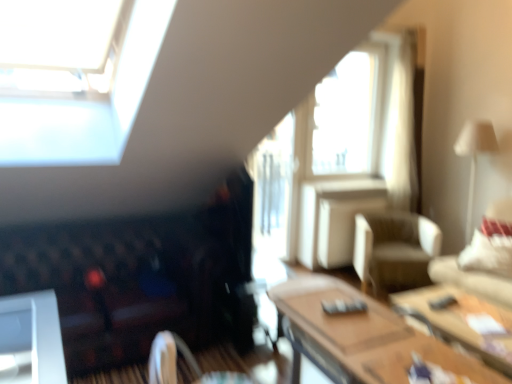
You are a GUI agent. You are given a task and a screenshot of the screen. Output one action in this format:
    pyautogui.click(x=<x>, y=<y>)
    Task: Click on the white fabric lampshade at upper right
    The image size is (512, 384).
    Given the screenshot: What is the action you would take?
    pyautogui.click(x=475, y=156)

You are a GUI agent. You are given a task and a screenshot of the screen. Output one action in this format:
    pyautogui.click(x=<x>, y=<y>)
    Task: Click on the velvet dark brown futon at lower left
    The height and width of the screenshot is (384, 512).
    Given the screenshot: What is the action you would take?
    pyautogui.click(x=124, y=281)

Measure the distance between point (x=129, y=277) and camera.

A distance of 2.94 meters exists between point (x=129, y=277) and camera.

In order to face wooden table at center, arranged as the second table when viewed from the right, should I rotate leftwards or rightwards?

A 12.171 degree turn to the right will do.

At what (x,y) coordinates should I click in order to perform the action: click on wooden table at center, the 2th table positioned from the back. Please return your answer as a coordinate pair (x, y). The width and height of the screenshot is (512, 384). Looking at the image, I should click on (360, 337).

This screenshot has height=384, width=512. In order to click on white fabric lampshade at upper right in this screenshot , I will do `click(475, 156)`.

From a real-world perspective, is wooden table at center, the 1th table from the left, positioned under beige fabric couch at right based on gravity?

Yes, from a real-world perspective, wooden table at center, the 1th table from the left, is below beige fabric couch at right.

Which is further, (330, 346) or (467, 283)?

The point (467, 283) is behind.

Considering the relative sizes of wooden table at center, the 2th table positioned from the back, and beige fabric couch at right in the image provided, is wooden table at center, the 2th table positioned from the back, smaller than beige fabric couch at right?

Yes.

Based on the photo, is wooden table at center, acting as the first table starting from the front, aimed at beige fabric couch at right?

Yes, wooden table at center, acting as the first table starting from the front, is aimed at beige fabric couch at right.

Looking at their sizes, would you say white fabric pillow at right is wider or thinner than wooden table at center, acting as the first table starting from the front?

In the image, white fabric pillow at right appears to be more narrow than wooden table at center, acting as the first table starting from the front.

Identify the location of pillow above the wooden table at center, the 2th table positioned from the back (from a real-world perspective). (488, 254).

From the image's perspective, is white fabric pillow at right on top of wooden table at center, acting as the first table starting from the front?

Yes, from the image's perspective, white fabric pillow at right is on top of wooden table at center, acting as the first table starting from the front.

Considering the positions of points (510, 268) and (375, 301), is point (510, 268) farther from camera compared to point (375, 301)?

Yes, it is behind point (375, 301).

Is white fabric pillow at right closer to camera compared to velvet dark brown swivel chair at lower center, placed as the first swivel chair when sorted from left to right?

No, it is not.

In the scene shown: From the image's perspective, between white fabric pillow at right and velvet dark brown swivel chair at lower center, which appears as the 2th swivel chair when viewed from the right, who is located below?

velvet dark brown swivel chair at lower center, which appears as the 2th swivel chair when viewed from the right, appears lower in the image.

Which is more to the left, white fabric pillow at right or velvet dark brown swivel chair at lower center, the 1th swivel chair viewed from the front?

Positioned to the left is velvet dark brown swivel chair at lower center, the 1th swivel chair viewed from the front.

Based on their sizes in the image, would you say white fabric pillow at right is bigger or smaller than velvet dark brown swivel chair at lower center, the 1th swivel chair viewed from the front?

In the image, white fabric pillow at right appears to be smaller than velvet dark brown swivel chair at lower center, the 1th swivel chair viewed from the front.

Can you confirm if velvet dark brown futon at lower left is positioned to the right of white fabric pillow at right?

No.

How many degrees apart are the facing directions of velvet dark brown futon at lower left and white fabric pillow at right?

There is a 89.5-degree angle between the facing directions of velvet dark brown futon at lower left and white fabric pillow at right.

Considering the relative sizes of velvet dark brown futon at lower left and white fabric pillow at right in the image provided, is velvet dark brown futon at lower left taller than white fabric pillow at right?

Yes, velvet dark brown futon at lower left is taller than white fabric pillow at right.

Is velvet dark brown futon at lower left far from white fabric pillow at right?

Yes, velvet dark brown futon at lower left and white fabric pillow at right are quite far apart.

In the image, is beige fabric couch at right positioned in front of or behind beige fabric swivel chair at center, the 2th swivel chair viewed from the left?

beige fabric couch at right is positioned closer to the viewer than beige fabric swivel chair at center, the 2th swivel chair viewed from the left.

Which object is thinner, beige fabric couch at right or beige fabric swivel chair at center, positioned as the second swivel chair in front-to-back order?

beige fabric swivel chair at center, positioned as the second swivel chair in front-to-back order, is thinner.

Does beige fabric couch at right have a larger size compared to beige fabric swivel chair at center, which is counted as the 1th swivel chair, starting from the back?

Yes.

Considering the relative sizes of wooden table at lower right, which is the first table from back to front, and beige fabric swivel chair at center, the 2th swivel chair viewed from the left, in the image provided, is wooden table at lower right, which is the first table from back to front, bigger than beige fabric swivel chair at center, the 2th swivel chair viewed from the left,?

Actually, wooden table at lower right, which is the first table from back to front, might be smaller than beige fabric swivel chair at center, the 2th swivel chair viewed from the left.

From a real-world perspective, does wooden table at lower right, positioned as the second table in left-to-right order, sit lower than beige fabric swivel chair at center, the 2th swivel chair viewed from the left?

Yes, from a real-world perspective, wooden table at lower right, positioned as the second table in left-to-right order, is beneath beige fabric swivel chair at center, the 2th swivel chair viewed from the left.

Is wooden table at lower right, positioned as the second table in left-to-right order, looking in the opposite direction of beige fabric swivel chair at center, the 2th swivel chair viewed from the left?

Yes, wooden table at lower right, positioned as the second table in left-to-right order, is facing away from beige fabric swivel chair at center, the 2th swivel chair viewed from the left.

Does wooden table at lower right, marked as the 2th table in a front-to-back arrangement, come in front of beige fabric swivel chair at center, positioned as the second swivel chair in front-to-back order?

That is True.

How different are the orientations of velvet dark brown futon at lower left and wooden table at lower right, which is the first table from back to front, in degrees?

There is a 0.679-degree angle between the facing directions of velvet dark brown futon at lower left and wooden table at lower right, which is the first table from back to front.

Measure the distance from velvet dark brown futon at lower left to wooden table at lower right, positioned as the second table in left-to-right order.

velvet dark brown futon at lower left is 5.51 feet away from wooden table at lower right, positioned as the second table in left-to-right order.

Does velvet dark brown futon at lower left appear on the right side of wooden table at lower right, which is the first table from back to front?

No.

From the picture: Would you say velvet dark brown futon at lower left is a long distance from wooden table at lower right, the first table viewed from the right?

Yes, velvet dark brown futon at lower left is far from wooden table at lower right, the first table viewed from the right.

Starting from the beige fabric couch at right, which table is the 2nd one to the left? Please provide its 2D coordinates.

[(360, 337)]

This screenshot has width=512, height=384. I want to click on pillow behind the wooden table at center, the 1th table from the left, so click(x=488, y=254).

Estimate the real-world distances between objects in this image. Which object is further from wooden table at center, the 2th table positioned from the back, beige fabric couch at right or velvet dark brown swivel chair at lower center, which is the second swivel chair from back to front?

beige fabric couch at right is positioned further to the anchor wooden table at center, the 2th table positioned from the back.

Considering their positions, is beige fabric swivel chair at center, the 1th swivel chair in the right-to-left sequence, positioned further to velvet dark brown futon at lower left than transparent glass window at upper center?

transparent glass window at upper center.

Looking at the image, which one is located further to transparent glass window at upper center, velvet dark brown swivel chair at lower center, the 1th swivel chair viewed from the front, or white fabric pillow at right?

The object further to transparent glass window at upper center is velvet dark brown swivel chair at lower center, the 1th swivel chair viewed from the front.

Looking at the image, which one is located closer to wooden table at center, the 1th table from the left, transparent glass window at upper center or velvet dark brown swivel chair at lower center, placed as the first swivel chair when sorted from left to right?

velvet dark brown swivel chair at lower center, placed as the first swivel chair when sorted from left to right, is positioned closer to the anchor wooden table at center, the 1th table from the left.

From the image, which object appears to be farther from transparent glass window at upper center, wooden table at lower right, positioned as the second table in left-to-right order, or beige fabric swivel chair at center, positioned as the second swivel chair in front-to-back order?

Among the two, wooden table at lower right, positioned as the second table in left-to-right order, is located further to transparent glass window at upper center.

Considering their positions, is white fabric lampshade at upper right positioned closer to beige fabric couch at right than transparent glass window at upper center?

white fabric lampshade at upper right is positioned closer to the anchor beige fabric couch at right.

Looking at the image, which one is located further to wooden table at lower right, marked as the 2th table in a front-to-back arrangement, wooden table at center, arranged as the second table when viewed from the right, or transparent glass window at upper center?

transparent glass window at upper center is positioned further to the anchor wooden table at lower right, marked as the 2th table in a front-to-back arrangement.

Which object lies nearer to the anchor point velvet dark brown futon at lower left, beige fabric swivel chair at center, which is counted as the 1th swivel chair, starting from the back, or white fabric pillow at right?

beige fabric swivel chair at center, which is counted as the 1th swivel chair, starting from the back, lies closer to velvet dark brown futon at lower left than the other object.

Where is `table between wooden table at center, arranged as the second table when viewed from the right, and white fabric lampshade at upper right in the front-back direction`? table between wooden table at center, arranged as the second table when viewed from the right, and white fabric lampshade at upper right in the front-back direction is located at coordinates (462, 323).

The width and height of the screenshot is (512, 384). What are the coordinates of `lamp between transparent glass window at upper center and beige fabric swivel chair at center, the 1th swivel chair in the right-to-left sequence, from top to bottom` in the screenshot? It's located at (475, 156).

This screenshot has height=384, width=512. In order to click on pillow located between velvet dark brown swivel chair at lower center, which appears as the 2th swivel chair when viewed from the right, and transparent glass window at upper center in the depth direction in this screenshot , I will do coord(488,254).

Image resolution: width=512 pixels, height=384 pixels. I want to click on table between velvet dark brown swivel chair at lower center, which is the second swivel chair from back to front, and beige fabric swivel chair at center, the 1th swivel chair in the right-to-left sequence, along the z-axis, so click(x=462, y=323).